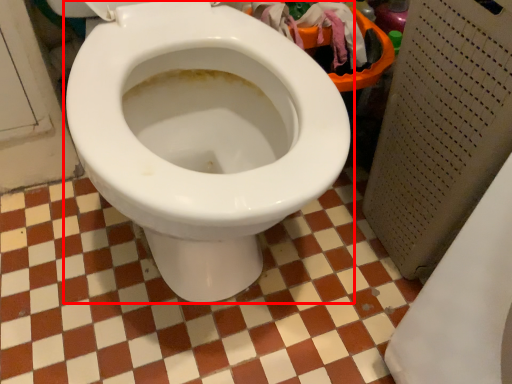
Question: In this image, where is toilet (annotated by the red box) located relative to ceramic tile?

Choices:
 (A) left
 (B) right

Answer: (A)